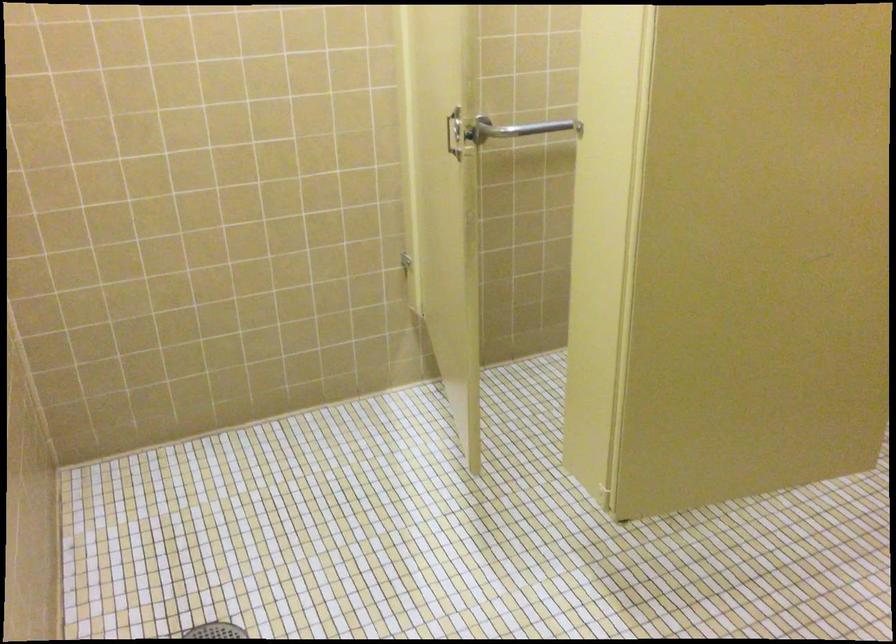
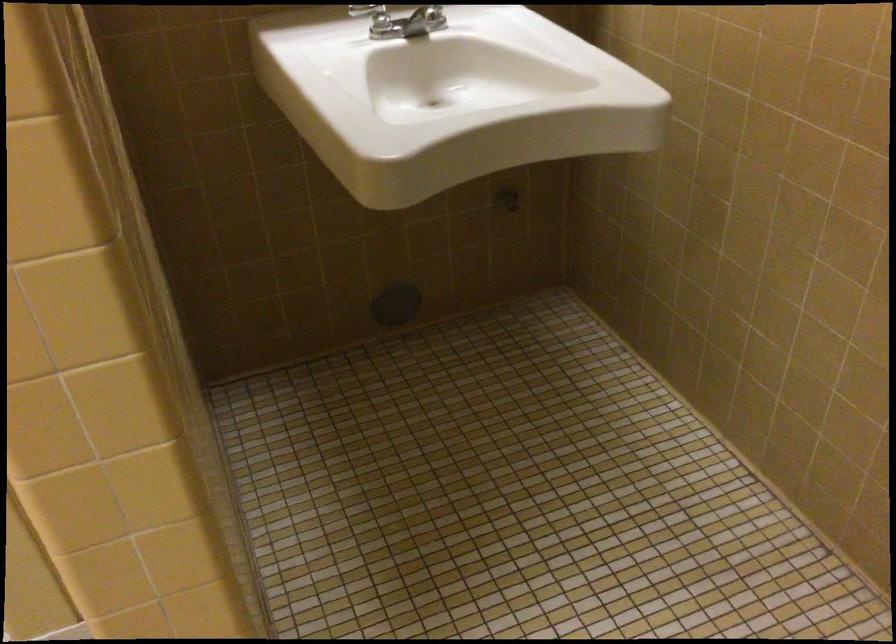
Based on the photo, first-person continuous shooting, in which direction is the camera rotating?

The camera rotated toward right-down.